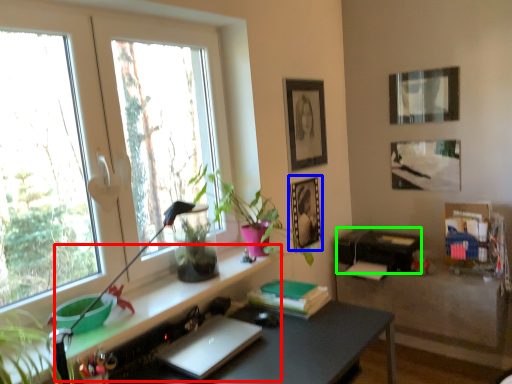
Question: Based on their relative distances, which object is nearer to shelf (highlighted by a red box)? Choose from picture frame (highlighted by a blue box) and printer (highlighted by a green box).

Choices:
 (A) picture frame
 (B) printer

Answer: (A)